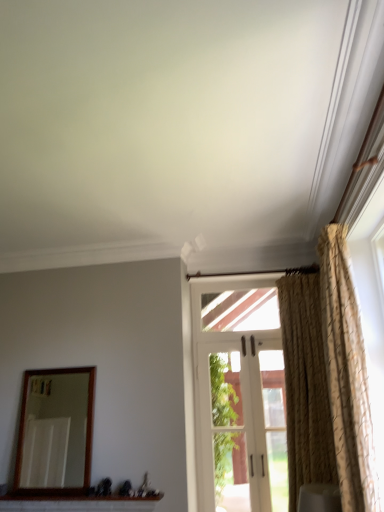
Describe the element at coordinates (56, 431) in the screenshot. I see `wooden-framed mirror at left` at that location.

What do you see at coordinates (347, 375) in the screenshot?
I see `gold textured curtain at right, positioned as the 1th curtain in front-to-back order` at bounding box center [347, 375].

Describe the element at coordinates (319, 498) in the screenshot. This screenshot has height=512, width=384. I see `white fabric curtain at right` at that location.

You are a GUI agent. You are given a task and a screenshot of the screen. Output one action in this format:
    pyautogui.click(x=<x>, y=<y>)
    Task: Click on the wooden-framed mirror at left
    This screenshot has width=384, height=512.
    Given the screenshot: What is the action you would take?
    pyautogui.click(x=56, y=431)

Is the position of white brick window sill at lower center less distant than that of beige textured curtain at right, the 1th curtain when ordered from back to front?

No.

Is white brick window sill at lower center oriented away from beige textured curtain at right, the 1th curtain when ordered from back to front?

No, white brick window sill at lower center is not facing the opposite direction of beige textured curtain at right, the 1th curtain when ordered from back to front.

From the image's perspective, which is below, white brick window sill at lower center or beige textured curtain at right, the 1th curtain when ordered from back to front?

white brick window sill at lower center appears lower in the image.

Is wooden-framed mirror at left positioned far away from white brick window sill at lower center?

Actually, wooden-framed mirror at left and white brick window sill at lower center are a little close together.

Can you tell me how much wooden-framed mirror at left and white brick window sill at lower center differ in facing direction?

There is a 0.102-degree angle between the facing directions of wooden-framed mirror at left and white brick window sill at lower center.

Between wooden-framed mirror at left and white brick window sill at lower center, which one appears on the left side from the viewer's perspective?

wooden-framed mirror at left is more to the left.

Which is behind, point (50, 380) or point (58, 505)?

The point (50, 380) is more distant.

Which is correct: white fabric curtain at right is inside gold textured curtain at right, which appears as the 2th curtain when viewed from the back, or outside of it?

white fabric curtain at right cannot be found inside gold textured curtain at right, which appears as the 2th curtain when viewed from the back.

Is white fabric curtain at right turned away from gold textured curtain at right, positioned as the 1th curtain in front-to-back order?

Yes.

Consider the image. Which of these two, white fabric curtain at right or gold textured curtain at right, which appears as the 2th curtain when viewed from the back, is bigger?

gold textured curtain at right, which appears as the 2th curtain when viewed from the back.

Would you say gold textured curtain at right, positioned as the 1th curtain in front-to-back order, contains wooden-framed mirror at left?

No, wooden-framed mirror at left is not surrounded by gold textured curtain at right, positioned as the 1th curtain in front-to-back order.

Is gold textured curtain at right, positioned as the 1th curtain in front-to-back order, oriented away from wooden-framed mirror at left?

That's not correct — gold textured curtain at right, positioned as the 1th curtain in front-to-back order, is not looking away from wooden-framed mirror at left.

Are gold textured curtain at right, which appears as the 2th curtain when viewed from the back, and wooden-framed mirror at left making contact?

No, gold textured curtain at right, which appears as the 2th curtain when viewed from the back, is not making contact with wooden-framed mirror at left.

Which object is further away from the camera taking this photo, gold textured curtain at right, which appears as the 2th curtain when viewed from the back, or wooden-framed mirror at left?

wooden-framed mirror at left is more distant.

From a real-world perspective, is wooden-framed mirror at left above or below beige textured curtain at right, the 1th curtain when ordered from back to front?

In terms of real-world spatial position, wooden-framed mirror at left is below beige textured curtain at right, the 1th curtain when ordered from back to front.

Where is `mirror that appears below the beige textured curtain at right, which is the 2th curtain from front to back (from the image's perspective)`? mirror that appears below the beige textured curtain at right, which is the 2th curtain from front to back (from the image's perspective) is located at coordinates (56, 431).

Is wooden-framed mirror at left surrounding beige textured curtain at right, which is the 2th curtain from front to back?

No, wooden-framed mirror at left does not contain beige textured curtain at right, which is the 2th curtain from front to back.

Relative to beige textured curtain at right, the 1th curtain when ordered from back to front, is wooden-framed mirror at left in front or behind?

In the image, wooden-framed mirror at left appears behind beige textured curtain at right, the 1th curtain when ordered from back to front.

Is beige textured curtain at right, the 1th curtain when ordered from back to front, to the left of white fabric curtain at right from the viewer's perspective?

No, beige textured curtain at right, the 1th curtain when ordered from back to front, is not to the left of white fabric curtain at right.

Is beige textured curtain at right, which is the 2th curtain from front to back, positioned before white fabric curtain at right?

No, beige textured curtain at right, which is the 2th curtain from front to back, is behind white fabric curtain at right.

From the image's perspective, relative to white fabric curtain at right, is beige textured curtain at right, which is the 2th curtain from front to back, above or below?

Based on their image positions, beige textured curtain at right, which is the 2th curtain from front to back, is located above white fabric curtain at right.

Looking at the image, does beige textured curtain at right, the 1th curtain when ordered from back to front, seem bigger or smaller compared to white fabric curtain at right?

Considering their sizes, beige textured curtain at right, the 1th curtain when ordered from back to front, takes up more space than white fabric curtain at right.

Is beige textured curtain at right, which is the 2th curtain from front to back, to the left of white brick window sill at lower center from the viewer's perspective?

Incorrect, beige textured curtain at right, which is the 2th curtain from front to back, is not on the left side of white brick window sill at lower center.

Is beige textured curtain at right, the 1th curtain when ordered from back to front, taller or shorter than white brick window sill at lower center?

Considering their sizes, beige textured curtain at right, the 1th curtain when ordered from back to front, has more height than white brick window sill at lower center.

From the image's perspective, which one is positioned lower, beige textured curtain at right, which is the 2th curtain from front to back, or white brick window sill at lower center?

white brick window sill at lower center.

From the image's perspective, starting from the white brick window sill at lower center, which curtain is the 1st one above? Please provide its 2D coordinates.

[(305, 385)]

This screenshot has height=512, width=384. Identify the location of window sill located below the wooden-framed mirror at left (from the image's perspective). (79, 503).

Considering their positions, is white fabric curtain at right positioned closer to wooden-framed mirror at left than gold textured curtain at right, positioned as the 1th curtain in front-to-back order?

white fabric curtain at right is closer to wooden-framed mirror at left.

Based on their spatial positions, is wooden-framed mirror at left or gold textured curtain at right, which appears as the 2th curtain when viewed from the back, closer to white brick window sill at lower center?

wooden-framed mirror at left is positioned closer to the anchor white brick window sill at lower center.

Estimate the real-world distances between objects in this image. Which object is further from white brick window sill at lower center, gold textured curtain at right, positioned as the 1th curtain in front-to-back order, or beige textured curtain at right, the 1th curtain when ordered from back to front?

gold textured curtain at right, positioned as the 1th curtain in front-to-back order, is positioned further to the anchor white brick window sill at lower center.

Considering their positions, is wooden-framed mirror at left positioned further to gold textured curtain at right, positioned as the 1th curtain in front-to-back order, than white brick window sill at lower center?

wooden-framed mirror at left is further to gold textured curtain at right, positioned as the 1th curtain in front-to-back order.

When comparing their distances from white brick window sill at lower center, does gold textured curtain at right, positioned as the 1th curtain in front-to-back order, or white fabric curtain at right seem closer?

white fabric curtain at right.

Which object lies nearer to the anchor point gold textured curtain at right, which appears as the 2th curtain when viewed from the back, beige textured curtain at right, which is the 2th curtain from front to back, or white fabric curtain at right?

Among the two, white fabric curtain at right is located nearer to gold textured curtain at right, which appears as the 2th curtain when viewed from the back.

From the image, which object appears to be nearer to wooden-framed mirror at left, gold textured curtain at right, which appears as the 2th curtain when viewed from the back, or white brick window sill at lower center?

white brick window sill at lower center is closer to wooden-framed mirror at left.

Based on their spatial positions, is white brick window sill at lower center or white fabric curtain at right closer to beige textured curtain at right, the 1th curtain when ordered from back to front?

Based on the image, white fabric curtain at right appears to be nearer to beige textured curtain at right, the 1th curtain when ordered from back to front.

Identify the location of window sill between wooden-framed mirror at left and white fabric curtain at right. This screenshot has width=384, height=512. (79, 503).

You are a GUI agent. You are given a task and a screenshot of the screen. Output one action in this format:
    pyautogui.click(x=<x>, y=<y>)
    Task: Click on the furniture situated between white brick window sill at lower center and gold textured curtain at right, positioned as the 1th curtain in front-to-back order, from left to right
    
    Given the screenshot: What is the action you would take?
    pyautogui.click(x=319, y=498)

The image size is (384, 512). I want to click on window sill between wooden-framed mirror at left and beige textured curtain at right, the 1th curtain when ordered from back to front, in the horizontal direction, so click(79, 503).

Locate an element on the screen. furniture between white brick window sill at lower center and beige textured curtain at right, the 1th curtain when ordered from back to front, in the horizontal direction is located at coordinates (319, 498).